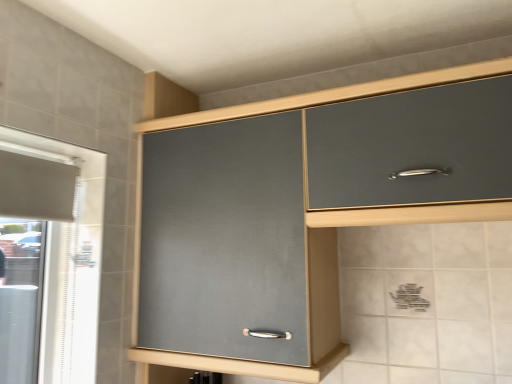
You are a GUI agent. You are given a task and a screenshot of the screen. Output one action in this format:
    pyautogui.click(x=<x>, y=<y>)
    Task: Click on the matte gray cabinet at upper center
    This screenshot has height=384, width=512.
    Given the screenshot: What is the action you would take?
    pyautogui.click(x=320, y=293)

The image size is (512, 384). Describe the element at coordinates (320, 293) in the screenshot. I see `matte gray cabinet at upper center` at that location.

Measure the distance between matte gray cabinet at upper center and camera.

38.92 inches.

Where is `matte gray cabinet at upper center`? The image size is (512, 384). matte gray cabinet at upper center is located at coordinates [320, 293].